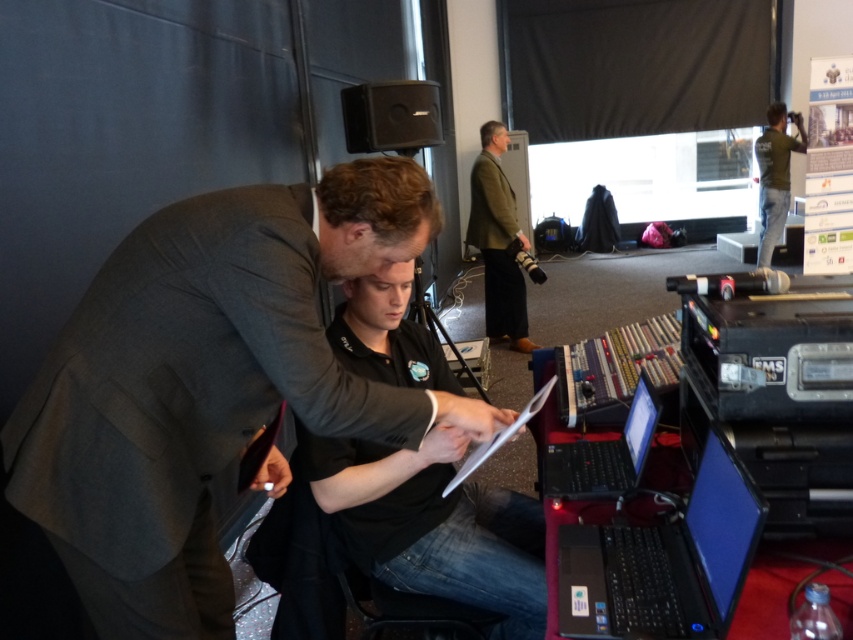
Question: Which point appears closest to the camera in this image?

Choices:
 (A) (149, 504)
 (B) (758, 256)

Answer: (A)

Question: Does green woolen blazer at center lie in front of green cotton shirt at upper right?

Choices:
 (A) no
 (B) yes

Answer: (B)

Question: Is black matte shirt at center wider than black matte laptop at center?

Choices:
 (A) no
 (B) yes

Answer: (B)

Question: Estimate the real-world distances between objects in this image. Which object is farther from the black matte laptop at center?

Choices:
 (A) dark gray suit at center
 (B) green woolen blazer at center

Answer: (B)

Question: Among these points, which one is farthest from the camera?

Choices:
 (A) (699, 577)
 (B) (508, 572)
 (C) (641, 394)
 (D) (523, 301)

Answer: (D)

Question: Is black matte shirt at center bigger than black matte laptop at center?

Choices:
 (A) no
 (B) yes

Answer: (B)